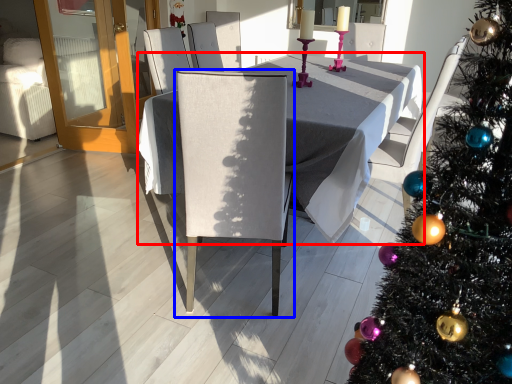
Question: Which point is closer to the camera, table (highlighted by a red box) or chair (highlighted by a blue box)?

Choices:
 (A) table
 (B) chair

Answer: (B)